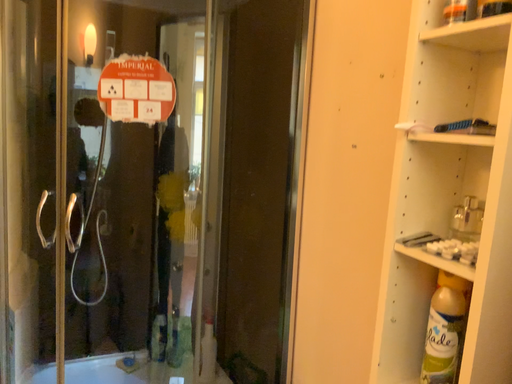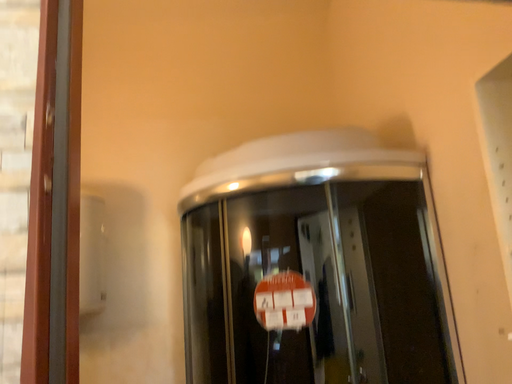
Question: Which way did the camera rotate in the video?

Choices:
 (A) rotated downward
 (B) rotated upward

Answer: (B)